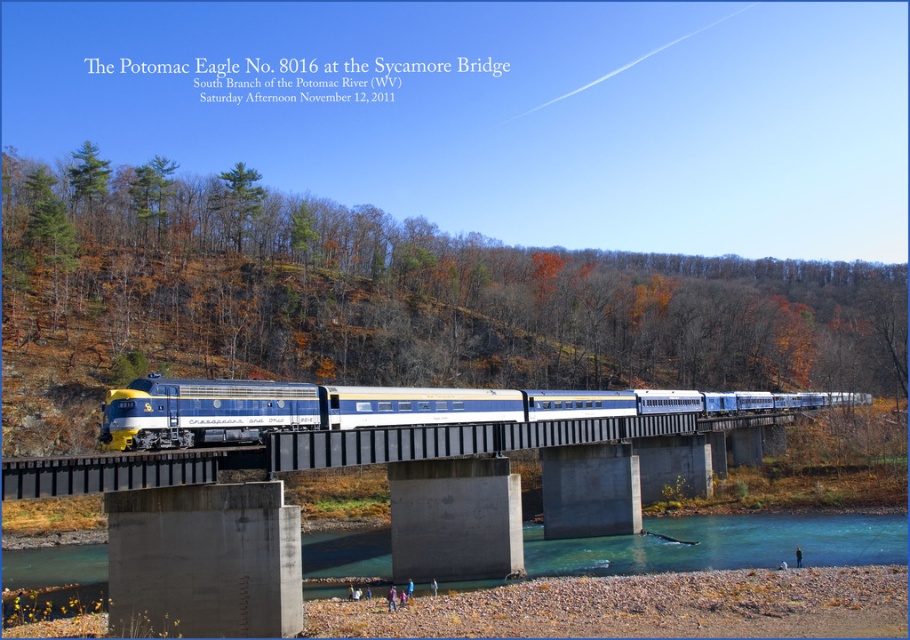
Question: Is blue polished metal train at center further to camera compared to concrete bridge at center?

Choices:
 (A) yes
 (B) no

Answer: (A)

Question: Does blue polished metal train at center appear under concrete bridge at center?

Choices:
 (A) no
 (B) yes

Answer: (A)

Question: Among these objects, which one is farthest from the camera?

Choices:
 (A) blue polished metal train at center
 (B) concrete bridge at center

Answer: (A)

Question: Can you confirm if blue polished metal train at center is positioned above concrete bridge at center?

Choices:
 (A) no
 (B) yes

Answer: (B)